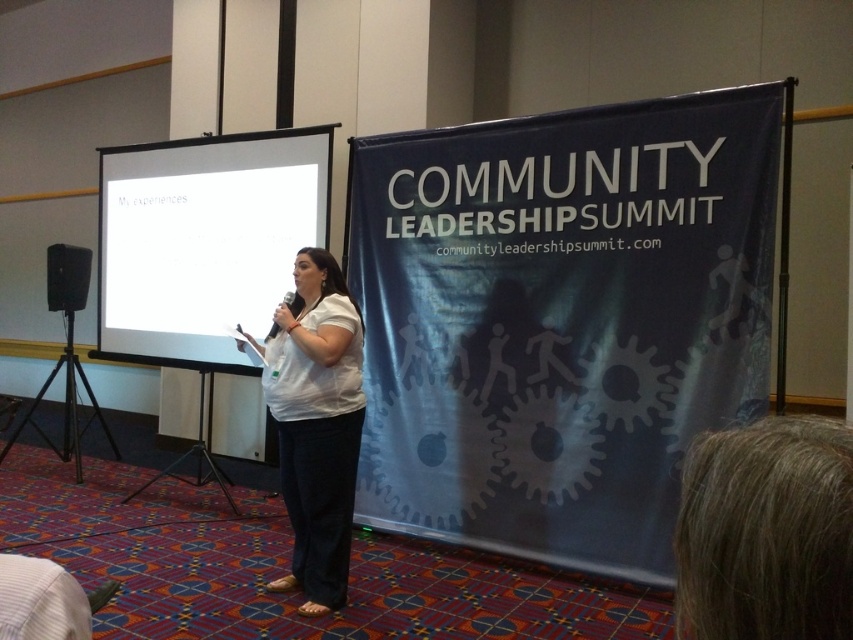
Between blue fabric banner at center and white glossy projection screen at center, which one appears on the right side from the viewer's perspective?

Positioned to the right is blue fabric banner at center.

Find the location of a particular element. The width and height of the screenshot is (853, 640). blue fabric banner at center is located at coordinates (561, 320).

What do you see at coordinates (561, 320) in the screenshot?
I see `blue fabric banner at center` at bounding box center [561, 320].

You are a GUI agent. You are given a task and a screenshot of the screen. Output one action in this format:
    pyautogui.click(x=<x>, y=<y>)
    Task: Click on the blue fabric banner at center
    The image size is (853, 640).
    Given the screenshot: What is the action you would take?
    pyautogui.click(x=561, y=320)

Between white glossy projection screen at center and white matte shirt at center, which one is positioned lower?

white matte shirt at center

Which is in front, point (160, 332) or point (314, 582)?

Point (314, 582)

Locate an element on the screen. The width and height of the screenshot is (853, 640). white glossy projection screen at center is located at coordinates (204, 241).

Locate an element on the screen. This screenshot has height=640, width=853. white glossy projection screen at center is located at coordinates (204, 241).

Can you confirm if blue fabric banner at center is bigger than white matte shirt at center?

Correct, blue fabric banner at center is larger in size than white matte shirt at center.

Which is behind, point (621, 353) or point (357, 371)?

Point (621, 353)

Where is `blue fabric banner at center`? blue fabric banner at center is located at coordinates (561, 320).